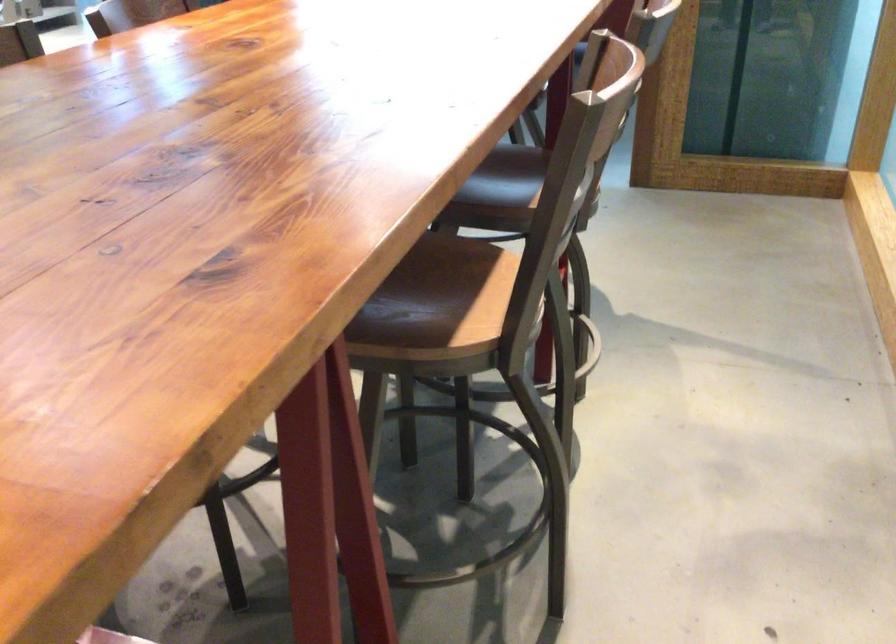
The images are taken continuously from a first-person perspective. In which direction is your viewpoint rotating?

The rotation direction of the camera is right-up.